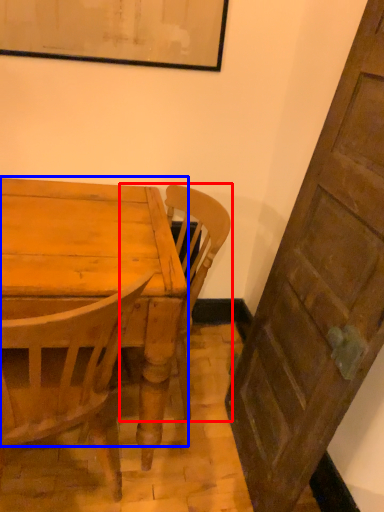
Question: Which of the following is the closest to the observer, chair (highlighted by a red box) or table top (highlighted by a blue box)?

Choices:
 (A) chair
 (B) table top

Answer: (B)